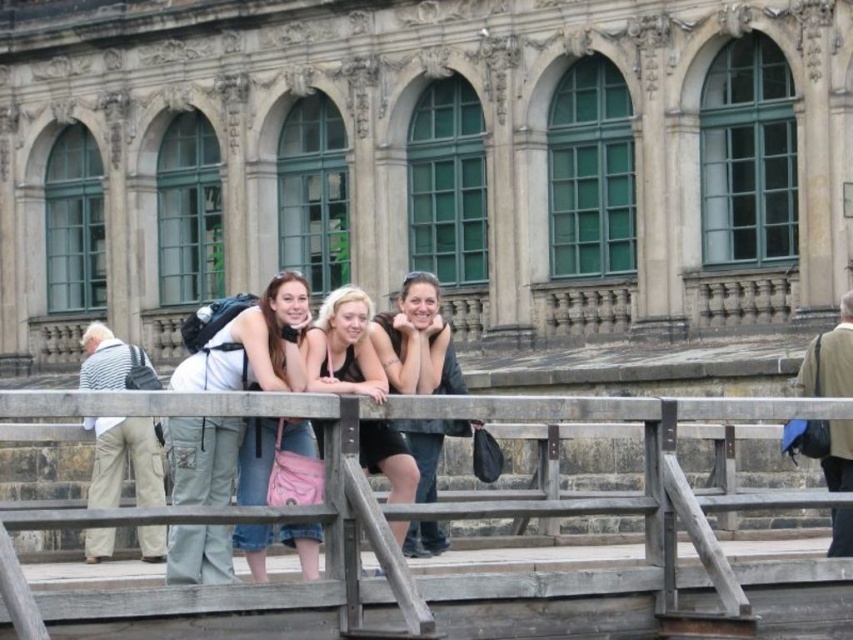
Question: Among these objects, which one is farthest from the camera?

Choices:
 (A) matte black tank top at center
 (B) wooden at center

Answer: (A)

Question: Observing the image, what is the correct spatial positioning of striped fabric shirt at left in reference to matte black tank top at center?

Choices:
 (A) right
 (B) left

Answer: (B)

Question: From the image, what is the correct spatial relationship of denim jeans at center in relation to matte black tank top at center?

Choices:
 (A) above
 (B) below

Answer: (B)

Question: Which point is farther to the camera?

Choices:
 (A) (387, 422)
 (B) (282, 380)
 (C) (408, 388)

Answer: (C)

Question: Which point is farther to the camera?

Choices:
 (A) (363, 452)
 (B) (463, 403)

Answer: (A)

Question: Does wooden at center come in front of matte black shirt at center?

Choices:
 (A) yes
 (B) no

Answer: (A)